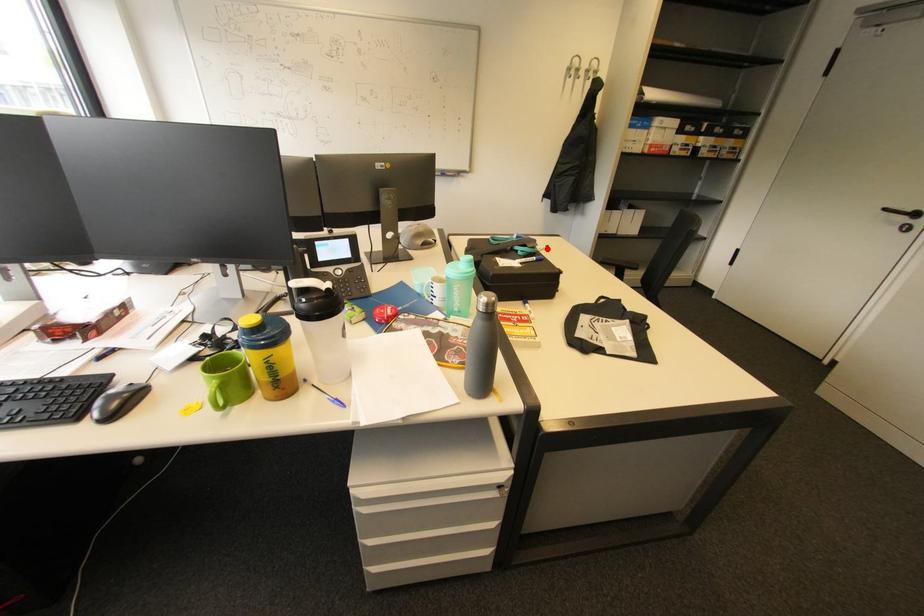
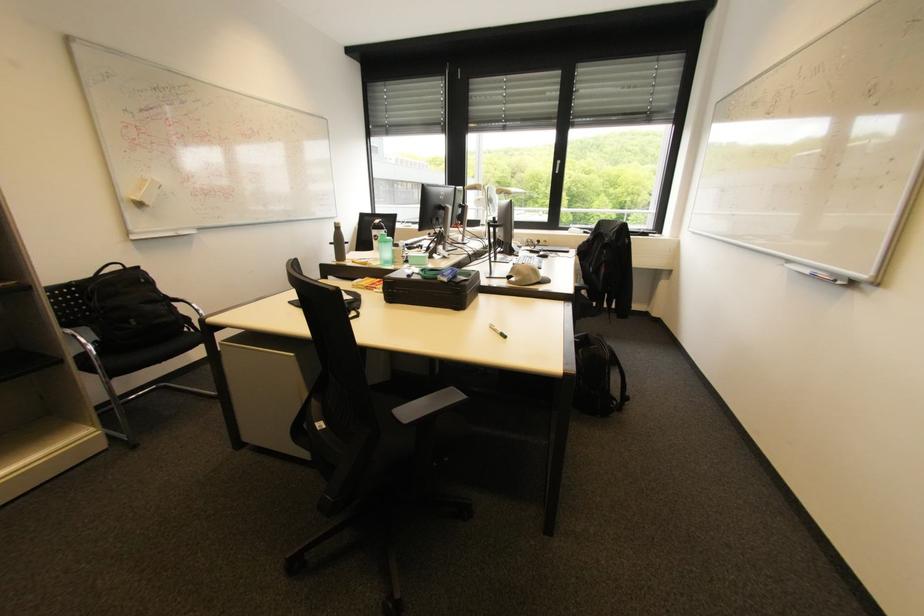
Find the pixel in the second image that matches the highlighted location in the first image.

(501, 329)